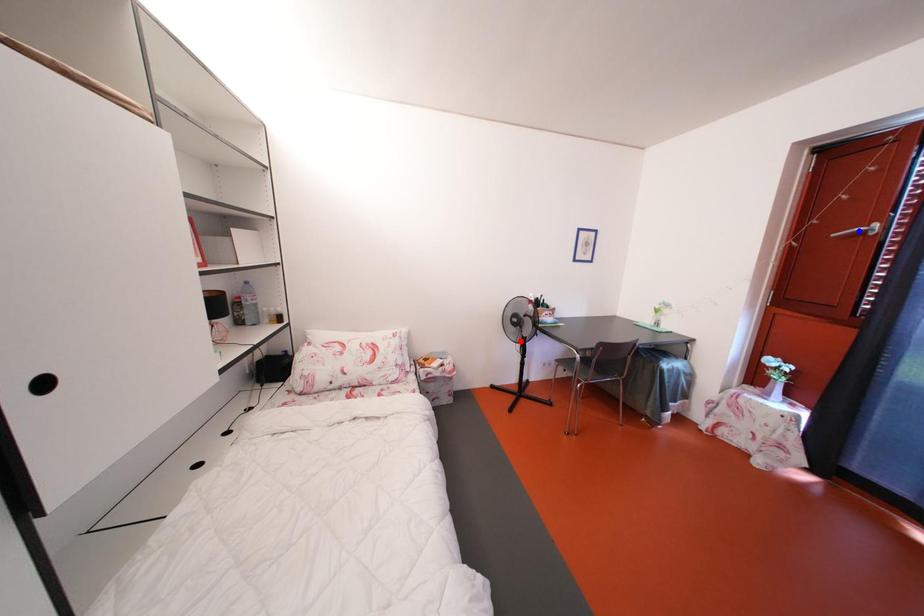
Question: Which of the two points in the image is closer to the camera?

Choices:
 (A) Blue point is closer.
 (B) Red point is closer.

Answer: (A)